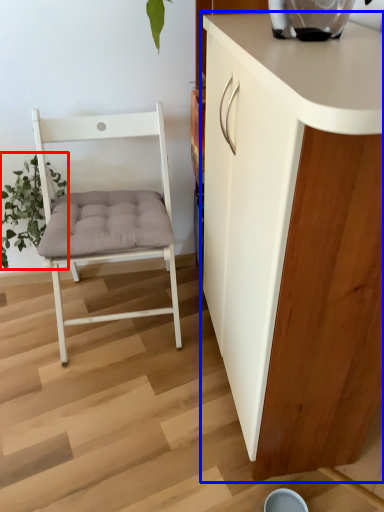
Question: Which object is further to the camera taking this photo, plant (highlighted by a red box) or cabinetry (highlighted by a blue box)?

Choices:
 (A) plant
 (B) cabinetry

Answer: (A)